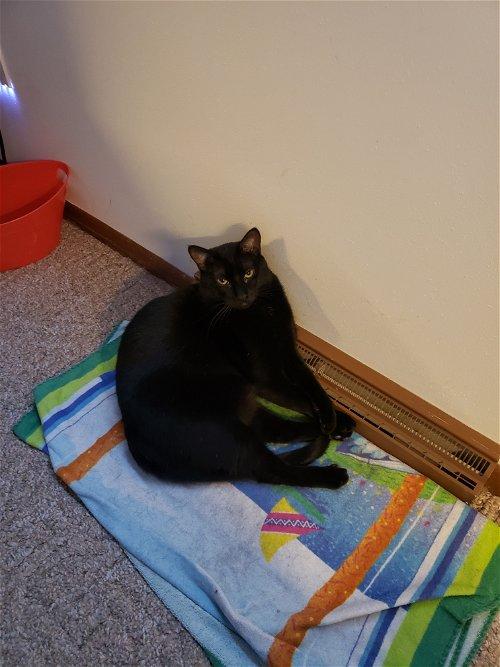
At what (x,y) coordinates should I click in order to perform the action: click on vent. Please return your answer as a coordinate pair (x, y). This screenshot has width=500, height=667. Looking at the image, I should click on (386, 402).